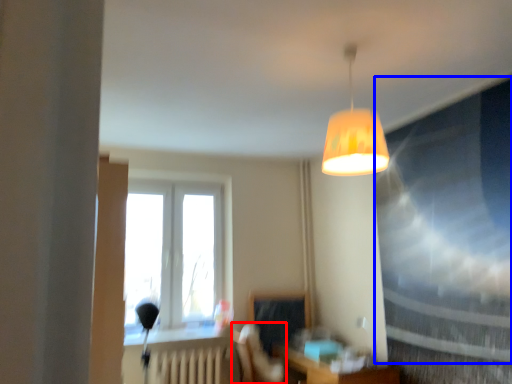
Question: Which of the following is the farthest to the observer, swivel chair (highlighted by a red box) or window screen (highlighted by a blue box)?

Choices:
 (A) swivel chair
 (B) window screen

Answer: (A)